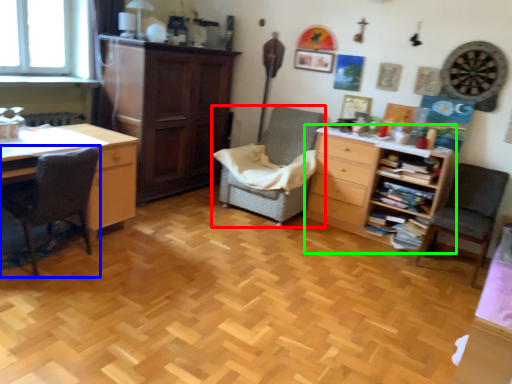
Question: Based on their relative distances, which object is nearer to chair (highlighted by a red box)? Choose from chair (highlighted by a blue box) and chest of drawers (highlighted by a green box).

Choices:
 (A) chair
 (B) chest of drawers

Answer: (B)